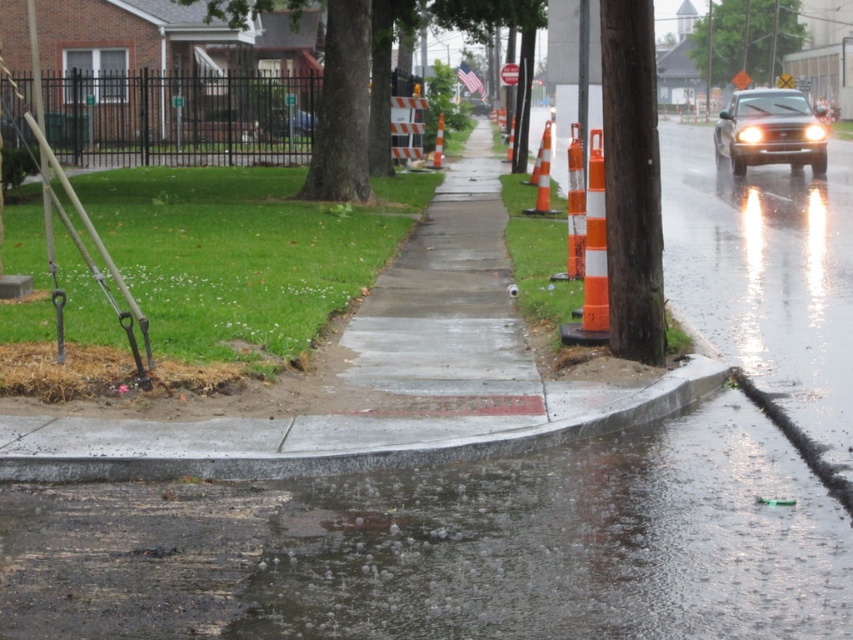
Question: From the image, what is the correct spatial relationship of shiny black car at right in relation to orange reflective cone at center?

Choices:
 (A) above
 (B) below

Answer: (A)

Question: From the image, what is the correct spatial relationship of gray concrete curb at lower center in relation to orange reflective traffic cone at center-right?

Choices:
 (A) below
 (B) above

Answer: (A)

Question: Which object appears closest to the camera in this image?

Choices:
 (A) shiny black car at right
 (B) gray concrete curb at lower center
 (C) orange reflective traffic cone at center

Answer: (B)

Question: Is orange reflective traffic cone at center-right to the right of orange reflective cone at center from the viewer's perspective?

Choices:
 (A) yes
 (B) no

Answer: (A)

Question: Among these points, which one is nearest to the camera?

Choices:
 (A) (769, 92)
 (B) (148, 461)

Answer: (B)

Question: Which point appears farthest from the camera in this image?

Choices:
 (A) (511, 131)
 (B) (550, 438)

Answer: (A)